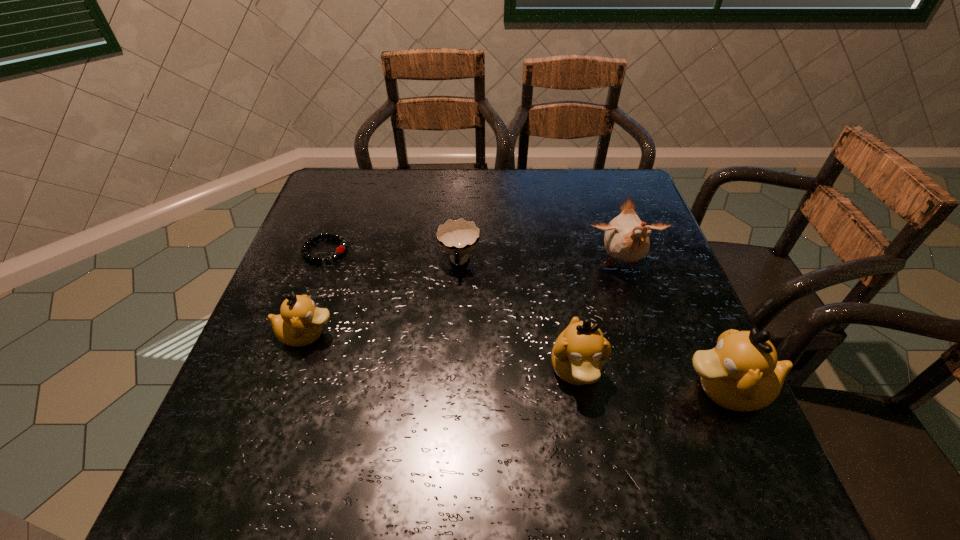
Find the location of a particular element. The height and width of the screenshot is (540, 960). free space that is in between the rightmost duckling and the bird is located at coordinates (673, 327).

Find the location of a particular element. Image resolution: width=960 pixels, height=540 pixels. blank region between the bird and the shortest duckling is located at coordinates (464, 299).

Image resolution: width=960 pixels, height=540 pixels. Find the location of `free space between the rightmost duckling and the bracelet`. free space between the rightmost duckling and the bracelet is located at coordinates (525, 320).

The width and height of the screenshot is (960, 540). Identify the location of free spot between the second shortest object and the bird. (540, 263).

The image size is (960, 540). I want to click on blank region between the leftmost duckling and the bird, so click(464, 299).

Where is `vacant space that is in between the rightmost duckling and the bird`? Image resolution: width=960 pixels, height=540 pixels. vacant space that is in between the rightmost duckling and the bird is located at coordinates (673, 327).

In order to click on unoccupied position between the second shortest object and the third shortest object in this screenshot , I will do `click(383, 299)`.

Locate an element on the screen. the second closest object to the bird is located at coordinates (741, 373).

This screenshot has width=960, height=540. What are the coordinates of `the second closest object to the fourth tallest object` in the screenshot? It's located at (459, 237).

Locate which duckling is the third closest to the shortest object. Please provide its 2D coordinates. Your answer should be formatted as a tuple, i.e. [(x, y)], where the tuple contains the x and y coordinates of a point satisfying the conditions above.

[(741, 373)]